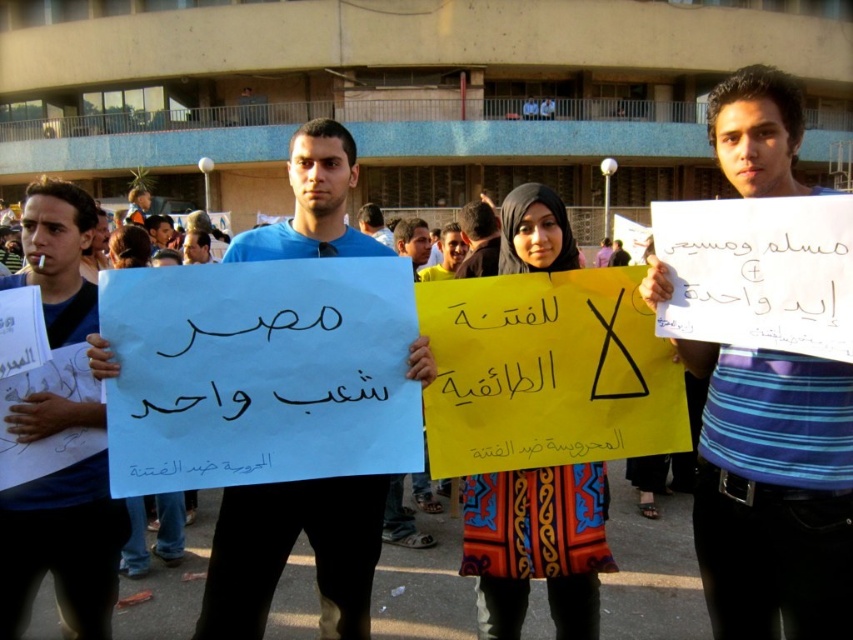
You are a photographer trying to capture a clear image of the blue paper at left and the matte blue shirt at center. Based on their positions, which object is closer to the camera?

The blue paper at left is closer to the camera since it is in front of the matte blue shirt at center.

You are a photographer trying to capture the protest scene. You notice a point at coordinates (773,492) in the image. Based on the scene description, what object or feature is located at this point?

The point at coordinates (773,492) is located on the blue striped shirt at center.

You are a photographer trying to capture the protest scene. You have two blue signs in your viewfinder. The blue paper sign at center and the blue paper at left. Which one should you focus on to get a larger subject in your photo?

The blue paper at left is larger, so focusing on it will result in a larger subject in the photo.